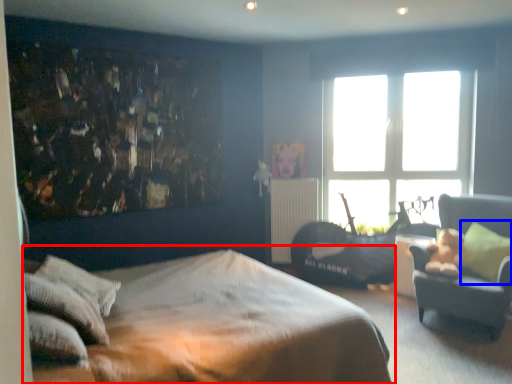
Question: Among these objects, which one is farthest to the camera, bed (highlighted by a red box) or pillow (highlighted by a blue box)?

Choices:
 (A) bed
 (B) pillow

Answer: (B)